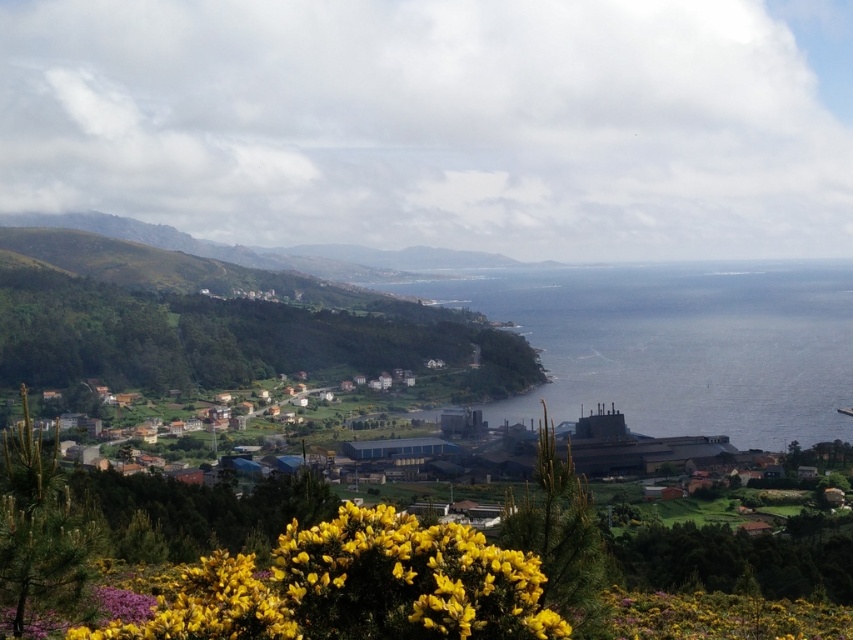
Question: Does blue water at center have a larger size compared to yellow matte flower at lower center?

Choices:
 (A) yes
 (B) no

Answer: (A)

Question: Among these objects, which one is farthest from the camera?

Choices:
 (A) blue water at center
 (B) yellow matte flower at lower center

Answer: (A)

Question: Which point is farther to the camera?

Choices:
 (A) blue water at center
 (B) yellow matte flower at lower center

Answer: (A)

Question: Does blue water at center appear on the right side of yellow matte flower at lower center?

Choices:
 (A) yes
 (B) no

Answer: (A)

Question: Is blue water at center thinner than yellow matte flower at lower center?

Choices:
 (A) no
 (B) yes

Answer: (A)